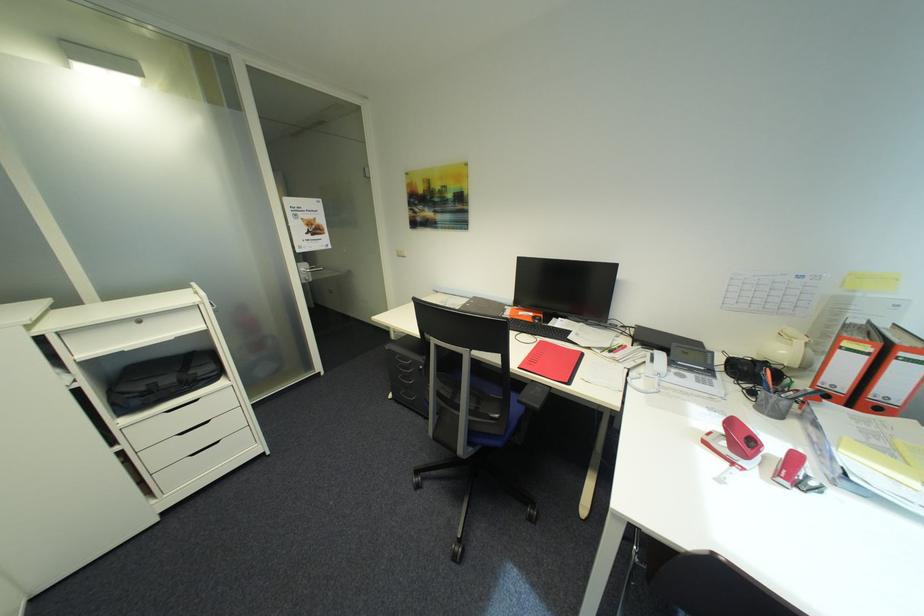
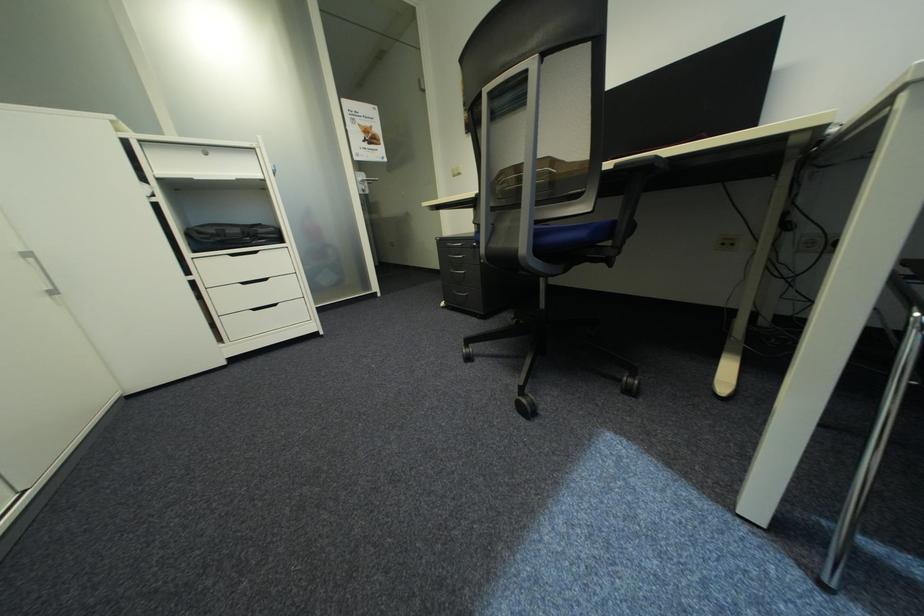
Question: Which direction would the cameraman need to move to produce the second image? Reply with the corresponding letter.

Choices:
 (A) Left
 (B) Right
 (C) Forward
 (D) Backward

Answer: (C)